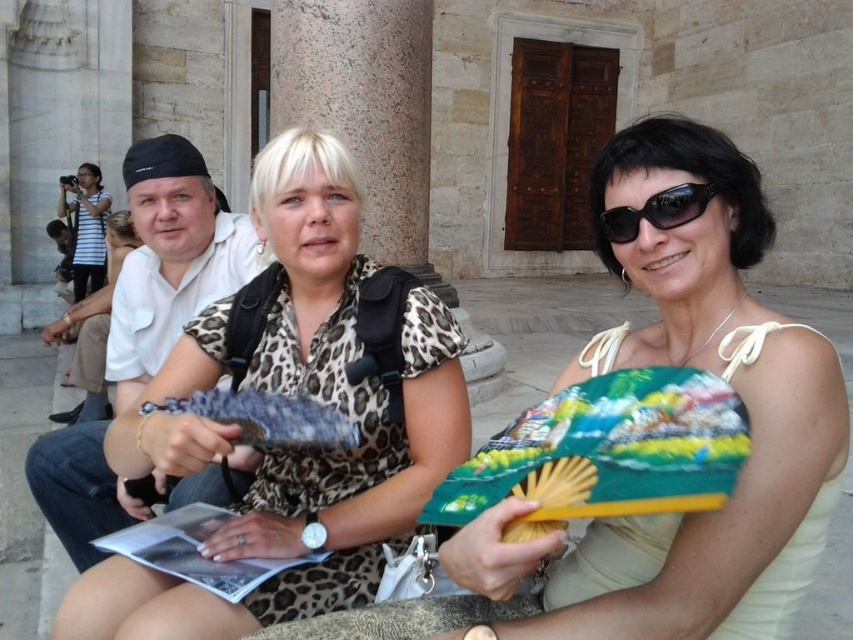
Is leopard print blouse at center positioned behind striped cotton shirt at upper left?

No, leopard print blouse at center is closer to the viewer.

Is leopard print blouse at center shorter than striped cotton shirt at upper left?

Correct, leopard print blouse at center is not as tall as striped cotton shirt at upper left.

Where is `leopard print blouse at center`? leopard print blouse at center is located at coordinates (308, 452).

Locate an element on the screen. leopard print blouse at center is located at coordinates (308, 452).

In the scene shown: How distant is leopard print blouse at center from white leopard print dress at center?

leopard print blouse at center is 8.87 meters from white leopard print dress at center.

Consider the image. Between leopard print blouse at center and white leopard print dress at center, which one has less height?

leopard print blouse at center is shorter.

Describe the element at coordinates (308, 452) in the screenshot. I see `leopard print blouse at center` at that location.

Identify the location of leopard print blouse at center. 308,452.

Who is taller, leopard print blouse at center or black plastic sunglasses at upper right?

Standing taller between the two is leopard print blouse at center.

Can you confirm if leopard print blouse at center is positioned to the left of black plastic sunglasses at upper right?

Correct, you'll find leopard print blouse at center to the left of black plastic sunglasses at upper right.

The width and height of the screenshot is (853, 640). What are the coordinates of `leopard print blouse at center` in the screenshot? It's located at click(x=308, y=452).